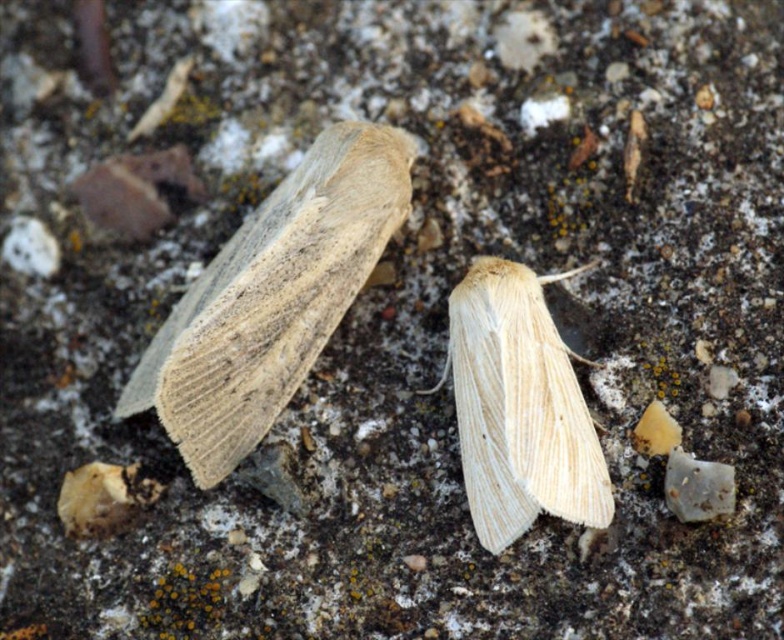
Does beige woolen moth at upper left have a larger size compared to light beige wool moth at center?

Correct, beige woolen moth at upper left is larger in size than light beige wool moth at center.

Is beige woolen moth at upper left taller than light beige wool moth at center?

Yes, beige woolen moth at upper left is taller than light beige wool moth at center.

This screenshot has height=640, width=784. What do you see at coordinates (271, 298) in the screenshot? I see `beige woolen moth at upper left` at bounding box center [271, 298].

In order to click on beige woolen moth at upper left in this screenshot , I will do `click(271, 298)`.